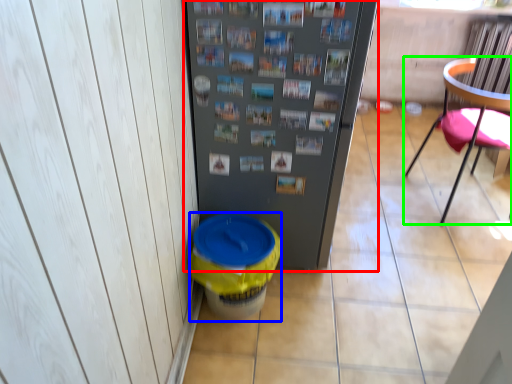
Question: Which is farther away from refrigerator (highlighted by a red box)? potty (highlighted by a blue box) or chair (highlighted by a green box)?

Choices:
 (A) potty
 (B) chair

Answer: (B)